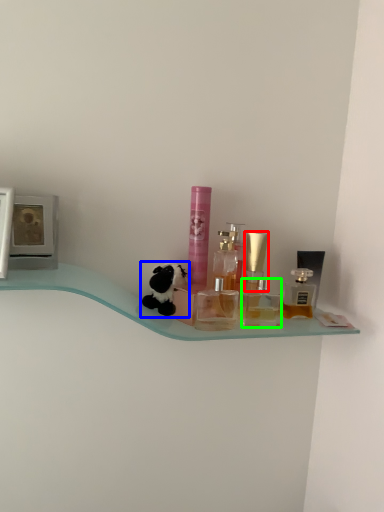
Question: Which object is the closest to the perfume (highlighted by a red box)? Choose among these: toy (highlighted by a blue box) or toiletry (highlighted by a green box).

Choices:
 (A) toy
 (B) toiletry

Answer: (B)